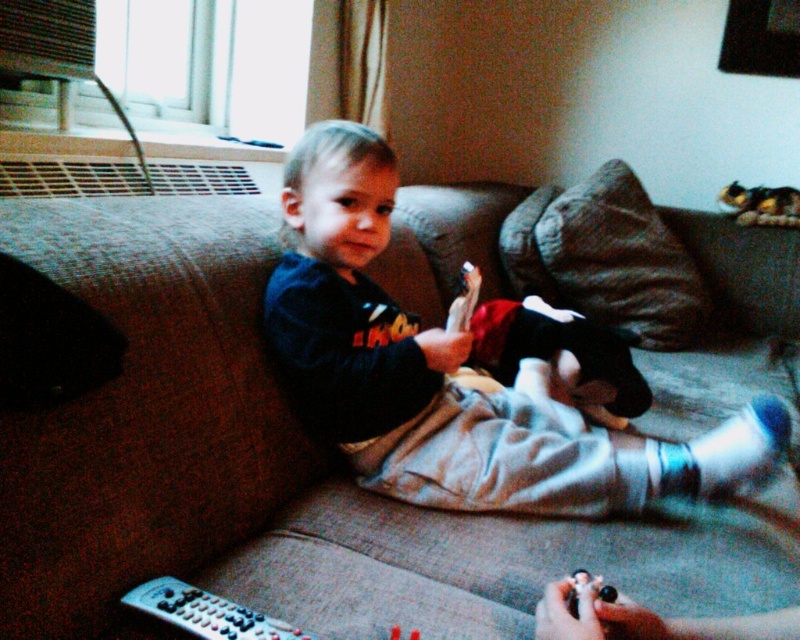
Question: Is black plastic remote at lower left closer to camera compared to fluffy plush cat at upper right?

Choices:
 (A) yes
 (B) no

Answer: (A)

Question: Which point is closer to the camera taking this photo?

Choices:
 (A) (444, 362)
 (B) (144, 589)
 (C) (778, 212)

Answer: (B)

Question: From the image, what is the correct spatial relationship of soft plush toy at center in relation to fluffy plush cat at upper right?

Choices:
 (A) above
 (B) below

Answer: (B)

Question: Which of these objects is positioned farthest from the fluffy plush cat at upper right?

Choices:
 (A) soft plush toy at center
 (B) brown fabric couch at center
 (C) black plastic remote at lower left

Answer: (C)

Question: Does soft plush toy at center have a lesser width compared to fluffy plush cat at upper right?

Choices:
 (A) no
 (B) yes

Answer: (A)

Question: Estimate the real-world distances between objects in this image. Which object is closer to the brown fabric couch at center?

Choices:
 (A) dark blue fleece at center
 (B) fluffy plush cat at upper right
 (C) soft plush toy at center

Answer: (A)